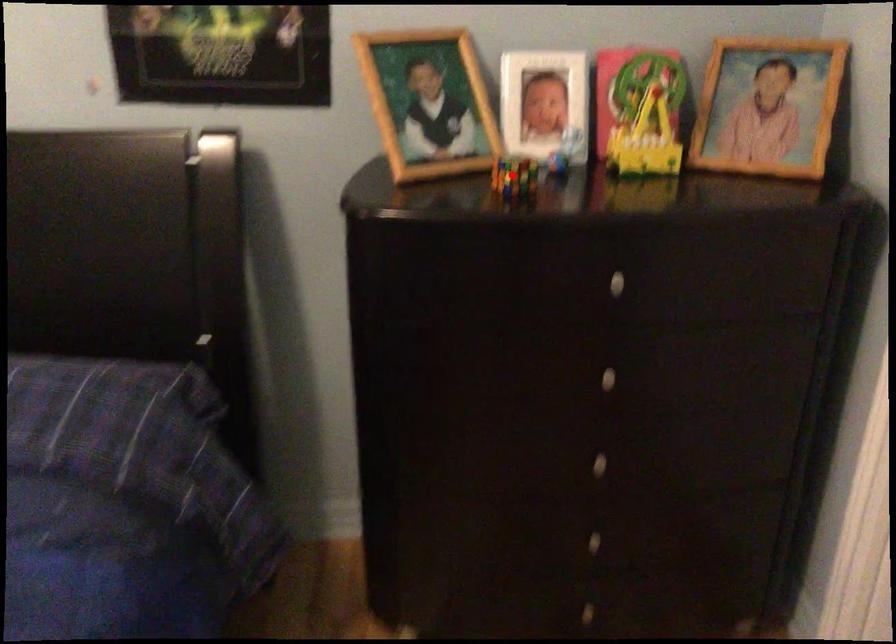
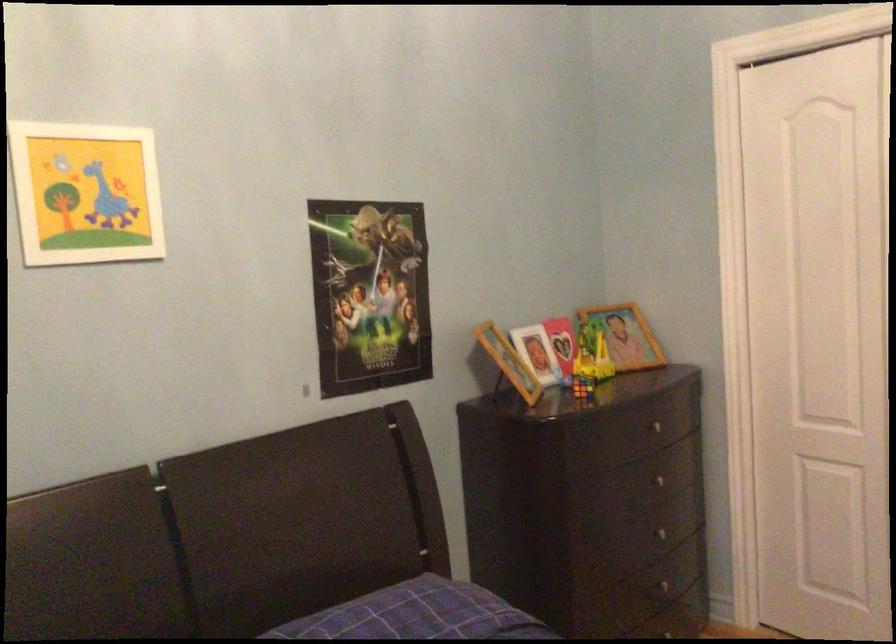
Find the pixel in the second image that matches the highlighted location in the first image.

(582, 386)